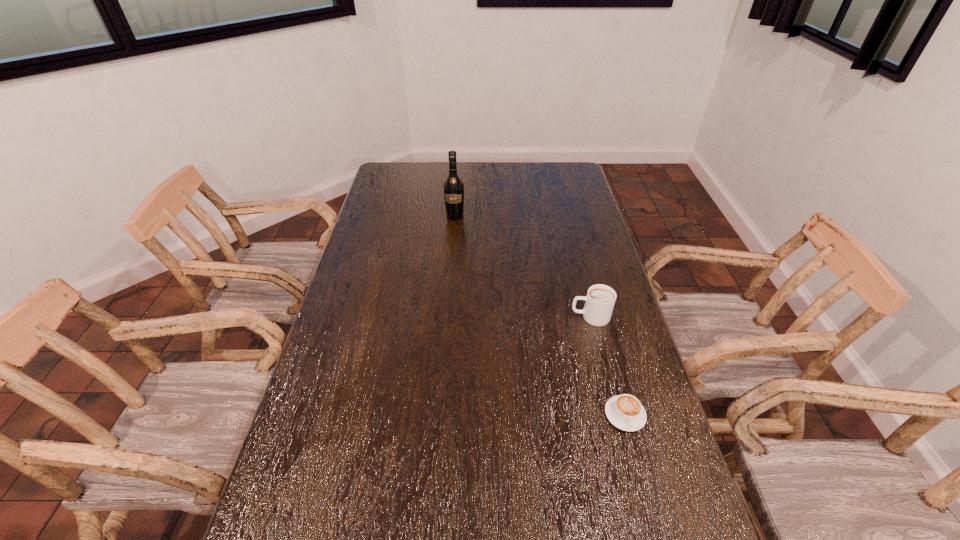
At what (x,y) coordinates should I click in order to perform the action: click on free space between the farthest object and the taller cappuccino. Please return your answer as a coordinate pair (x, y). The height and width of the screenshot is (540, 960). Looking at the image, I should click on (522, 266).

Find the location of a particular element. This screenshot has width=960, height=540. free point between the nearest object and the farther cappuccino is located at coordinates (608, 366).

You are a GUI agent. You are given a task and a screenshot of the screen. Output one action in this format:
    pyautogui.click(x=<x>, y=<y>)
    Task: Click on the empty space that is in between the farther cappuccino and the nearer cappuccino
    This screenshot has height=540, width=960.
    Given the screenshot: What is the action you would take?
    pyautogui.click(x=608, y=366)

What are the coordinates of `vacant space in between the leftmost object and the shortest object` in the screenshot? It's located at (540, 315).

This screenshot has width=960, height=540. I want to click on free space between the leftmost object and the nearer cappuccino, so click(x=540, y=315).

Find the location of a particular element. The width and height of the screenshot is (960, 540). empty location between the shorter cappuccino and the second nearest object is located at coordinates (608, 366).

Where is `object that is the second closest one to the nearer cappuccino`? object that is the second closest one to the nearer cappuccino is located at coordinates (453, 186).

You are a GUI agent. You are given a task and a screenshot of the screen. Output one action in this format:
    pyautogui.click(x=<x>, y=<y>)
    Task: Click on the object that stands as the second closest to the shortest object
    The width and height of the screenshot is (960, 540).
    Given the screenshot: What is the action you would take?
    pyautogui.click(x=453, y=186)